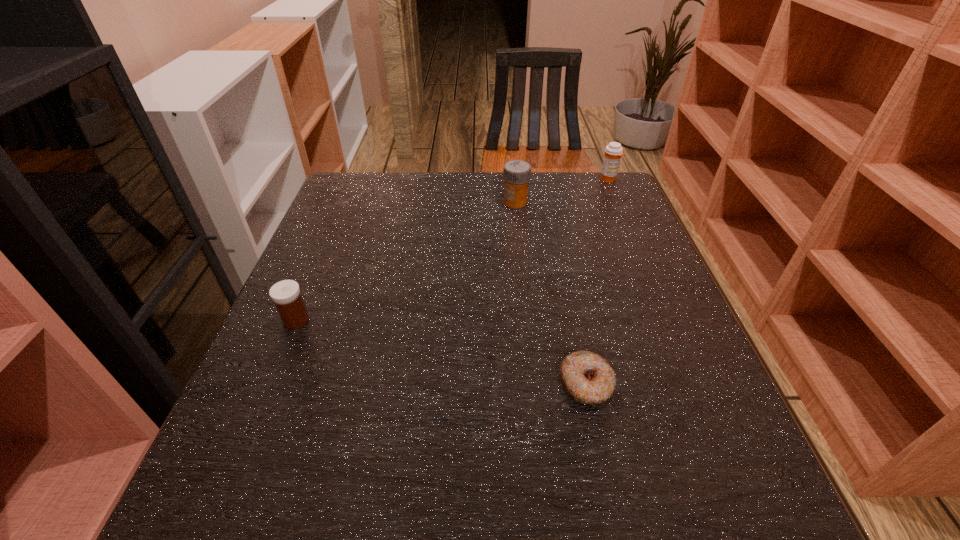
At what (x,y) coordinates should I click in order to perform the action: click on vacant space located 0.140m on the label side of the second nearest medicine. Please return your answer as a coordinate pair (x, y). The width and height of the screenshot is (960, 540). Looking at the image, I should click on (451, 202).

Locate an element on the screen. This screenshot has width=960, height=540. vacant space located 0.200m on the label side of the second nearest medicine is located at coordinates pos(430,202).

Find the location of a particular element. This screenshot has height=540, width=960. free space located on the right of the second nearest object is located at coordinates (468, 320).

The image size is (960, 540). Find the location of `vacant space situated on the back of the shortest object`. vacant space situated on the back of the shortest object is located at coordinates (569, 303).

Where is `object situated at the left edge`? The height and width of the screenshot is (540, 960). object situated at the left edge is located at coordinates (286, 295).

Locate an element on the screen. object at the right edge is located at coordinates (613, 152).

Identify the location of object positioned at the far right corner. (613, 152).

The height and width of the screenshot is (540, 960). Identify the location of vacant point at the far edge. (445, 216).

Locate an element on the screen. free spot at the near edge of the desktop is located at coordinates (562, 520).

At what (x,y) coordinates should I click in order to perform the action: click on vacant area at the left edge of the desktop. Please return your answer as a coordinate pair (x, y). The height and width of the screenshot is (540, 960). Looking at the image, I should click on (302, 401).